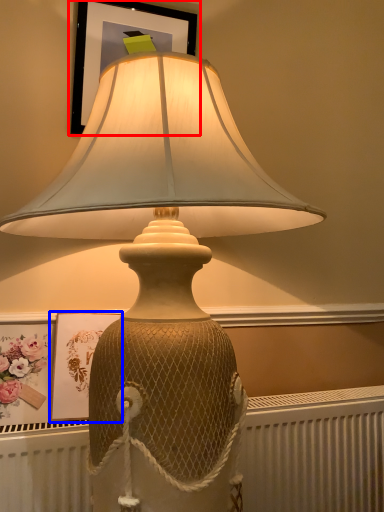
Question: Which object is further to the camera taking this photo, picture frame (highlighted by a red box) or picture frame (highlighted by a blue box)?

Choices:
 (A) picture frame
 (B) picture frame

Answer: (A)